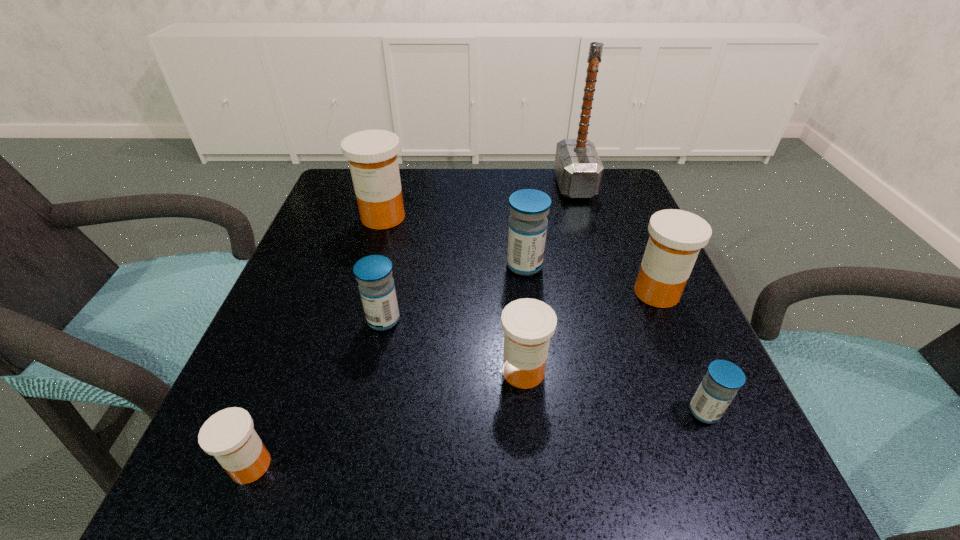
The height and width of the screenshot is (540, 960). Identify the location of hammer located in the right edge section of the desktop. (578, 168).

Locate an element on the screen. The image size is (960, 540). object present at the far left corner is located at coordinates (372, 154).

The height and width of the screenshot is (540, 960). Identify the location of object present at the near left corner. (228, 435).

Identify the location of object present at the far right corner. The image size is (960, 540). (578, 168).

In the image, there is a desktop. Identify the location of vacant space at the far edge. The width and height of the screenshot is (960, 540). (415, 168).

Identify the location of vacant region at the near edge of the desktop. The height and width of the screenshot is (540, 960). (357, 495).

Locate an element on the screen. vacant space at the left edge of the desktop is located at coordinates (337, 249).

In the image, there is a desktop. In order to click on free space at the right edge in this screenshot , I will do `click(652, 446)`.

Where is `free space at the near left corner of the desktop`? This screenshot has width=960, height=540. free space at the near left corner of the desktop is located at coordinates (286, 469).

In the image, there is a desktop. Identify the location of vacant space at the near right corner. (675, 494).